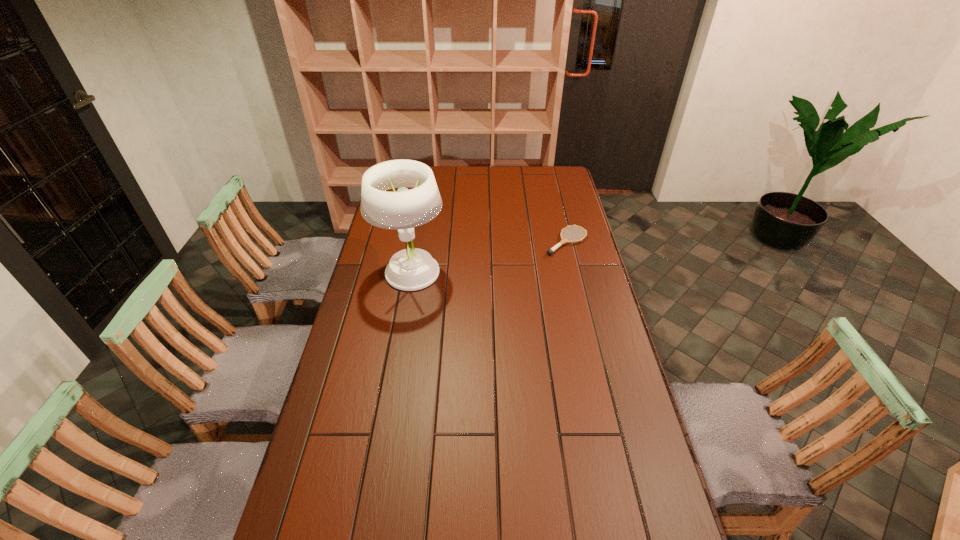
Select which object is the second closest to the icecream. Please provide its 2D coordinates. Your answer should be formatted as a tuple, i.e. [(x, y)], where the tuple contains the x and y coordinates of a point satisfying the conditions above.

[(550, 251)]

Identify the location of free location that satisfies the following two spatial constraints: 1. on the front side of the shortest object; 2. on the right side of the farthest object. (399, 241).